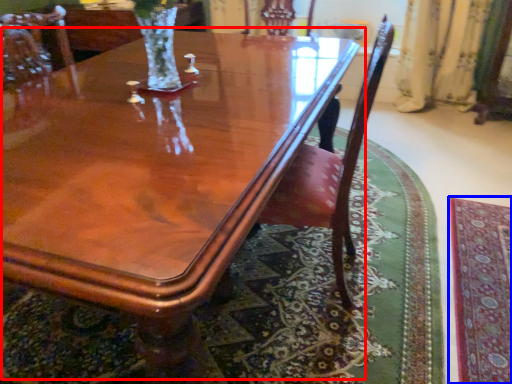
Question: Among these objects, which one is nearest to the camera, coffee table (highlighted by a red box) or mat (highlighted by a blue box)?

Choices:
 (A) coffee table
 (B) mat

Answer: (A)